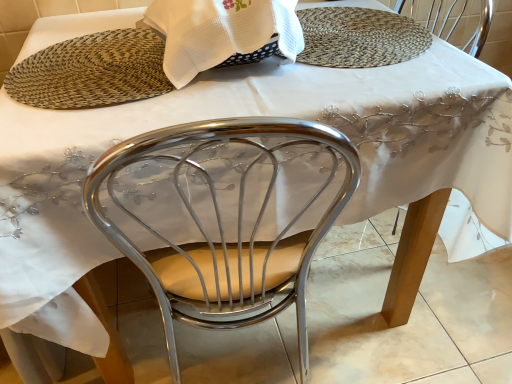
Question: Is woven straw placemat at upper center bigger than woven mat at upper center?

Choices:
 (A) yes
 (B) no

Answer: (B)

Question: Is woven straw placemat at upper center looking in the opposite direction of woven mat at upper center?

Choices:
 (A) yes
 (B) no

Answer: (B)

Question: Is woven straw placemat at upper center positioned far away from woven mat at upper center?

Choices:
 (A) no
 (B) yes

Answer: (A)

Question: Is woven straw placemat at upper center aimed at woven mat at upper center?

Choices:
 (A) yes
 (B) no

Answer: (B)

Question: From a real-world perspective, is woven straw placemat at upper center under woven mat at upper center?

Choices:
 (A) yes
 (B) no

Answer: (A)

Question: Considering the positions of white woven cloth at upper center and woven mat at upper center in the image, is white woven cloth at upper center wider or thinner than woven mat at upper center?

Choices:
 (A) thin
 (B) wide

Answer: (A)

Question: Based on their sizes in the image, would you say white woven cloth at upper center is bigger or smaller than woven mat at upper center?

Choices:
 (A) small
 (B) big

Answer: (B)

Question: From the image's perspective, is white woven cloth at upper center positioned above or below woven mat at upper center?

Choices:
 (A) below
 (B) above

Answer: (B)

Question: In the image, is white woven cloth at upper center positioned in front of or behind woven mat at upper center?

Choices:
 (A) behind
 (B) front

Answer: (B)

Question: From a real-world perspective, is woven mat at upper center positioned above or below white woven cloth at upper center?

Choices:
 (A) above
 (B) below

Answer: (B)

Question: From the image's perspective, is woven mat at upper center above or below white woven cloth at upper center?

Choices:
 (A) below
 (B) above

Answer: (A)

Question: Relative to white woven cloth at upper center, is woven mat at upper center in front or behind?

Choices:
 (A) behind
 (B) front

Answer: (A)

Question: Based on their positions, is woven mat at upper center located to the left or right of white woven cloth at upper center?

Choices:
 (A) left
 (B) right

Answer: (A)

Question: Considering the positions of point tap(128, 89) and point tap(402, 29), is point tap(128, 89) closer or farther from the camera than point tap(402, 29)?

Choices:
 (A) closer
 (B) farther

Answer: (A)

Question: Is woven mat at upper center wider or thinner than woven straw placemat at upper center?

Choices:
 (A) wide
 (B) thin

Answer: (B)